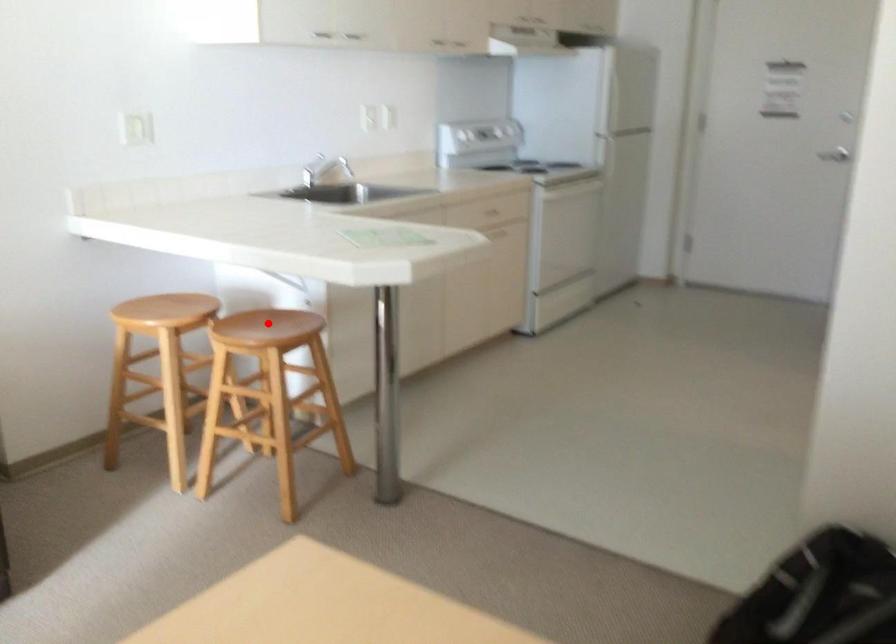
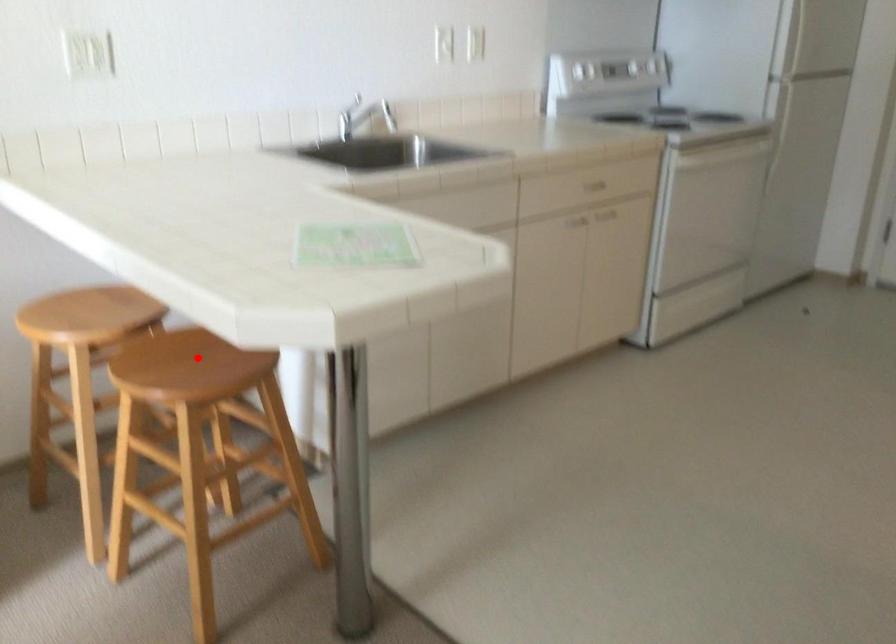
I am providing you with two images of the same scene from different viewpoints. A red point is marked on the first image and another point is marked on the second image. Are the points marked in image1 and image2 representing the same 3D position?

Yes